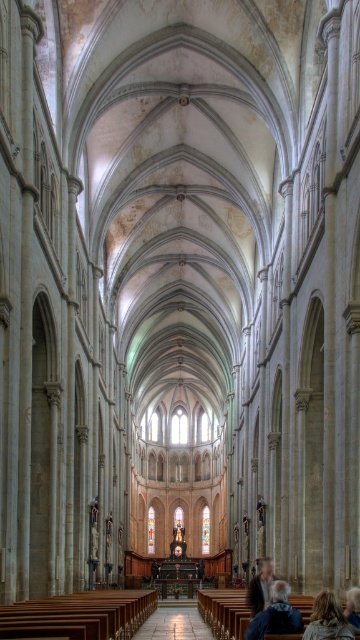
Who is more forward, (343, 634) or (254, 589)?

Positioned in front is point (343, 634).

Between blonde hair at lower right and dark brown leather jacket at lower center, which one has less height?

blonde hair at lower right

This screenshot has width=360, height=640. In order to click on blonde hair at lower right in this screenshot , I will do `click(327, 618)`.

Image resolution: width=360 pixels, height=640 pixels. In order to click on blonde hair at lower right in this screenshot , I will do `click(327, 618)`.

Who is positioned more to the left, dark brown leather jacket at lower center or gray hair at center?

From the viewer's perspective, dark brown leather jacket at lower center appears more on the left side.

Is point (266, 586) in front of point (353, 618)?

No, it is behind (353, 618).

Describe the element at coordinates (261, 586) in the screenshot. I see `dark brown leather jacket at lower center` at that location.

Find the location of `dark brown leather jacket at lower center`. dark brown leather jacket at lower center is located at coordinates (261, 586).

Looking at this image, who is taller, blonde hair at lower right or gray hair at center?

gray hair at center is taller.

This screenshot has width=360, height=640. Describe the element at coordinates (327, 618) in the screenshot. I see `blonde hair at lower right` at that location.

Locate an element on the screen. The image size is (360, 640). blonde hair at lower right is located at coordinates (327, 618).